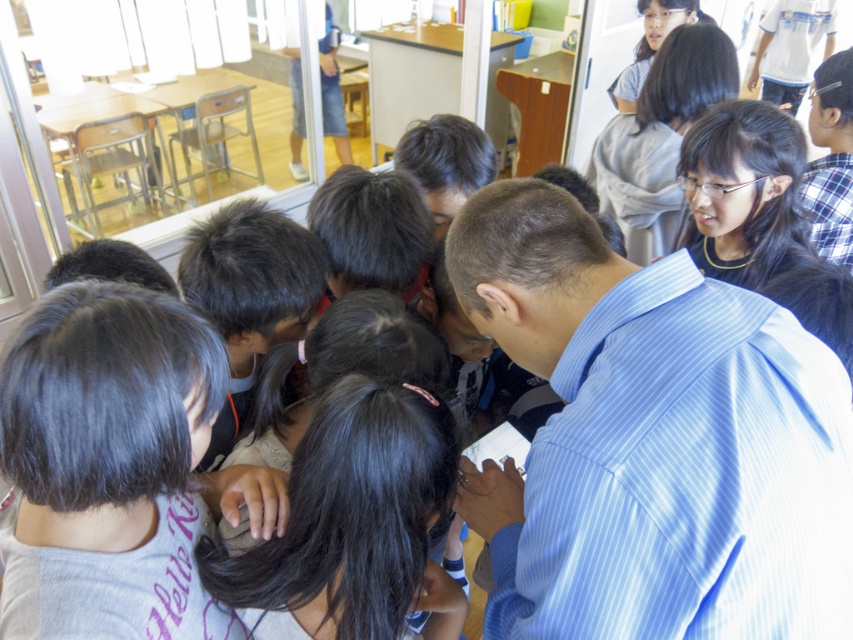
Question: Which object is closer to the camera taking this photo?

Choices:
 (A) black hair at center
 (B) dark gray hair at center
 (C) blue striped shirt at center

Answer: (C)

Question: Does dark gray hair at center appear over black hair at center?

Choices:
 (A) no
 (B) yes

Answer: (B)

Question: Is dark gray hair at center behind matte gray shirt at upper right?

Choices:
 (A) no
 (B) yes

Answer: (A)

Question: Which of the following is the farthest from the observer?

Choices:
 (A) (749, 337)
 (B) (384, 449)
 (C) (666, 200)

Answer: (C)

Question: Is black hair at center wider than matte gray shirt at upper right?

Choices:
 (A) no
 (B) yes

Answer: (A)

Question: Estimate the real-world distances between objects in this image. Which object is closer to the matte gray shirt at upper right?

Choices:
 (A) black hair at center
 (B) blue striped shirt at center

Answer: (B)